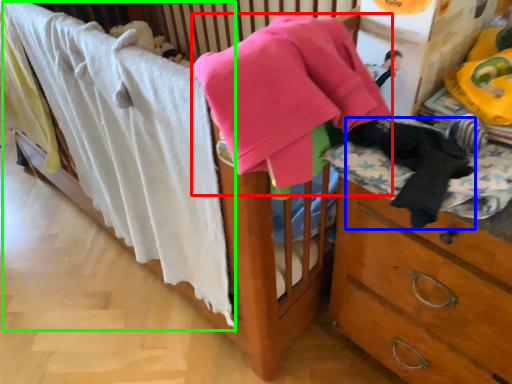
Question: Considering the real-world distances, which object is closest to baby clothe (highlighted by a red box)? clothing (highlighted by a blue box) or bath towel (highlighted by a green box).

Choices:
 (A) clothing
 (B) bath towel

Answer: (A)